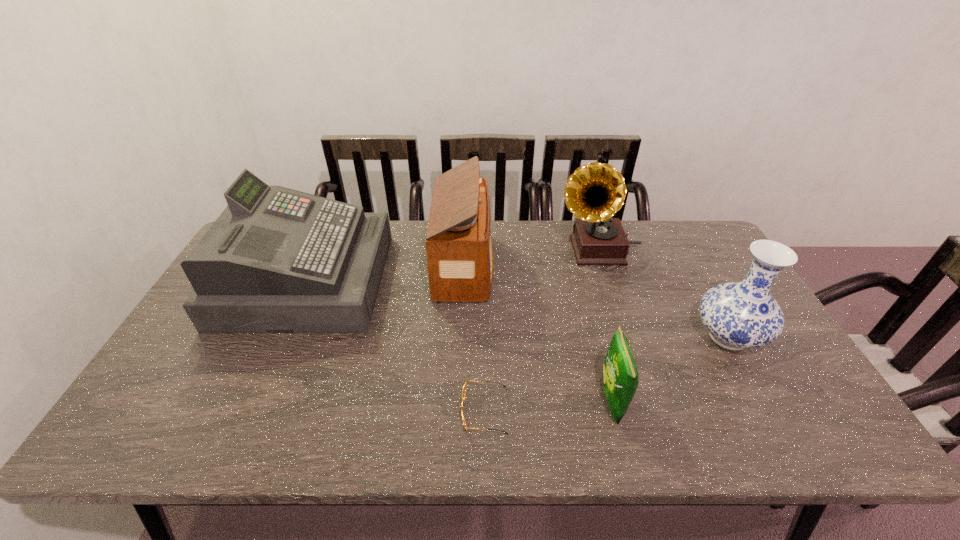
Find the location of a particular element. The width and height of the screenshot is (960, 540). free space located on the front-facing side of the cash register is located at coordinates (498, 280).

The width and height of the screenshot is (960, 540). Find the location of `vacant space located 0.170m on the front of the vase`. vacant space located 0.170m on the front of the vase is located at coordinates (779, 427).

Identify the location of free point located 0.400m on the front-facing side of the crisp (potato chip). The width and height of the screenshot is (960, 540). (430, 401).

This screenshot has height=540, width=960. What are the coordinates of `vacant space situated on the front-facing side of the crisp (potato chip)` in the screenshot? It's located at (456, 401).

In order to click on free space located on the front-facing side of the crisp (potato chip) in this screenshot , I will do `click(435, 401)`.

Locate an element on the screen. This screenshot has width=960, height=540. vacant position located on the front-facing side of the shortest object is located at coordinates (410, 410).

In order to click on vacant area located 0.380m on the front-facing side of the shortest object in this screenshot , I will do `click(298, 410)`.

Image resolution: width=960 pixels, height=540 pixels. I want to click on vacant region located 0.130m on the front-facing side of the shortest object, so click(x=405, y=410).

The width and height of the screenshot is (960, 540). What are the coordinates of `radio receiver that is at the far edge` in the screenshot? It's located at (460, 258).

I want to click on phonograph record that is at the far edge, so click(594, 192).